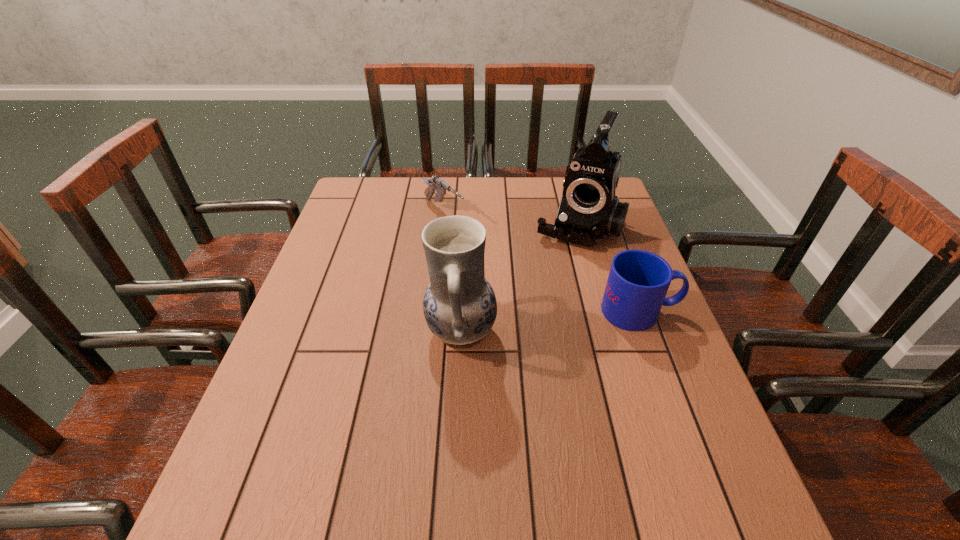
I want to click on pottery, so click(x=459, y=305).

The image size is (960, 540). Find the location of `the third tallest object`. the third tallest object is located at coordinates (638, 281).

Identify the location of the shortest object. The image size is (960, 540). (436, 183).

Find the location of a particular element. camcorder is located at coordinates (589, 211).

Where is `vacant space located on the back of the pottery`? The height and width of the screenshot is (540, 960). vacant space located on the back of the pottery is located at coordinates (465, 256).

This screenshot has width=960, height=540. What are the coordinates of `vacant space located at the barrel of the gun` in the screenshot? It's located at (538, 294).

Locate an element on the screen. Image resolution: width=960 pixels, height=540 pixels. vacant space located at the barrel of the gun is located at coordinates (470, 238).

Find the location of a particular element. vacant space situated 0.150m at the barrel of the gun is located at coordinates (485, 250).

Locate an element on the screen. free space located 0.320m on the lens mount of the camcorder is located at coordinates (531, 328).

Image resolution: width=960 pixels, height=540 pixels. I want to click on blank space located on the lens mount of the camcorder, so click(559, 268).